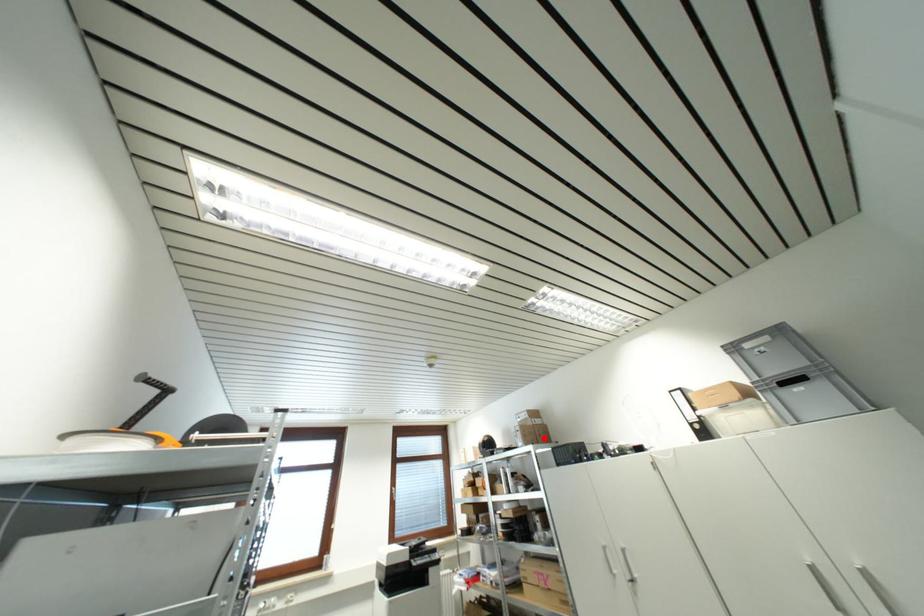
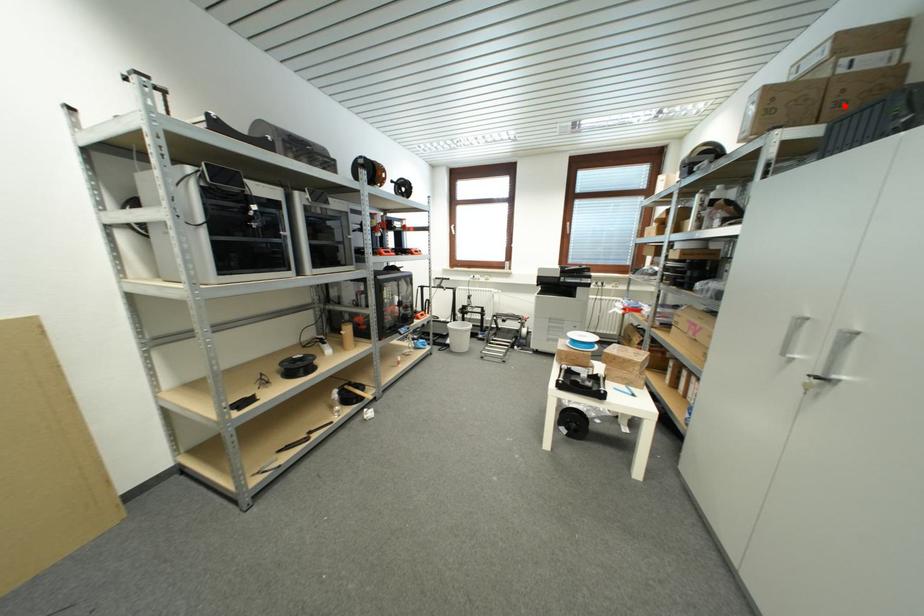
I am providing you with two images of the same scene from different viewpoints. A red point is marked on the first image and another point is marked on the second image. Is the marked point in image1 the same physical position as the marked point in image2?

Yes